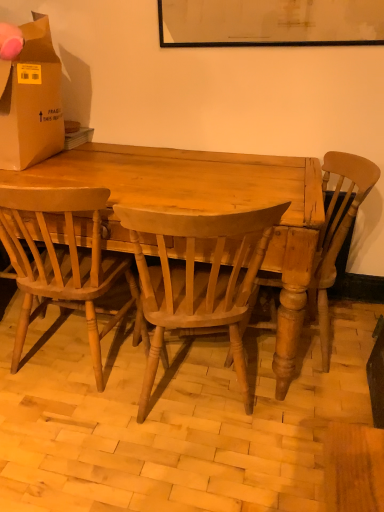
Question: From a real-world perspective, is light brown wood chair at center, which is the first chair in left-to-right order, above or below light brown wood chair at center, acting as the 1th chair starting from the right?

Choices:
 (A) below
 (B) above

Answer: (A)

Question: Considering the relative positions of light brown wood chair at center, placed as the third chair when sorted from right to left, and light brown wood chair at center, acting as the 1th chair starting from the right, in the image provided, is light brown wood chair at center, placed as the third chair when sorted from right to left, to the left or to the right of light brown wood chair at center, acting as the 1th chair starting from the right,?

Choices:
 (A) right
 (B) left

Answer: (B)

Question: Which object is the closest to the light brown wood desk at center?

Choices:
 (A) brown cardboard box at upper left
 (B) light brown wood chair at center, which is the second chair from right to left
 (C) light brown wood chair at center, acting as the 1th chair starting from the right
 (D) light brown wood chair at center, placed as the third chair when sorted from right to left

Answer: (B)

Question: Which object is the closest to the light brown wood desk at center?

Choices:
 (A) light brown wood chair at center, acting as the 1th chair starting from the right
 (B) light brown wood chair at center, which is the second chair from right to left
 (C) light brown wood chair at center, which is the first chair in left-to-right order
 (D) brown cardboard box at upper left

Answer: (B)